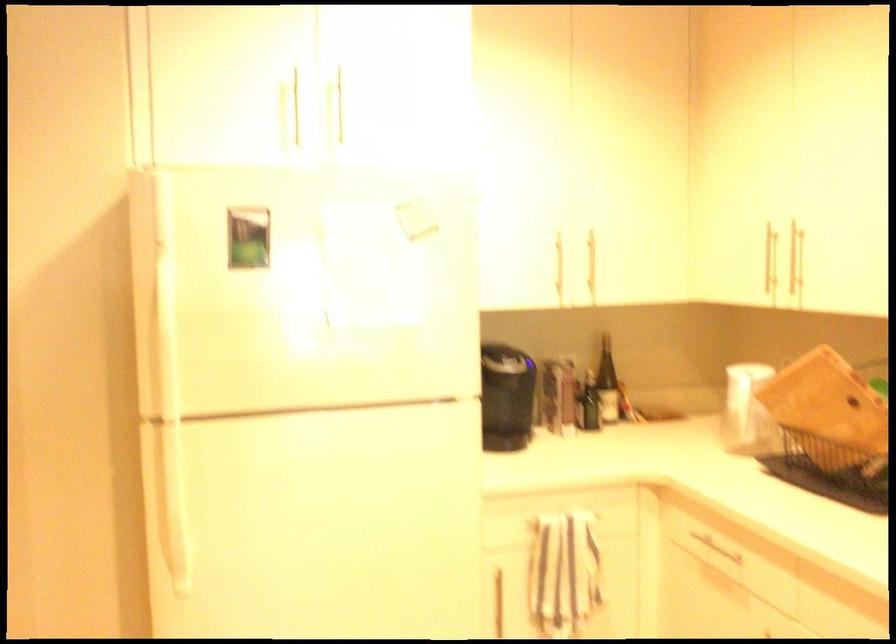
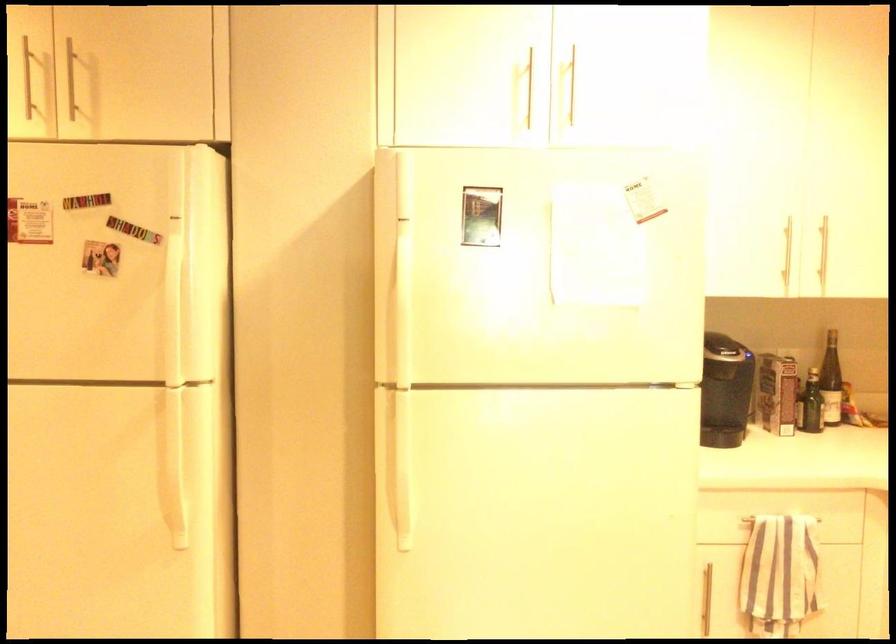
Find the pixel in the second image that matches (x=300, y=88) in the first image.

(540, 75)